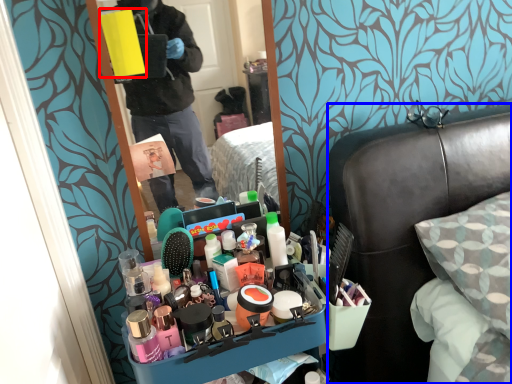
Question: Which object appears closest to the camera in this image, box (highlighted by a red box) or furniture (highlighted by a blue box)?

Choices:
 (A) box
 (B) furniture

Answer: (B)